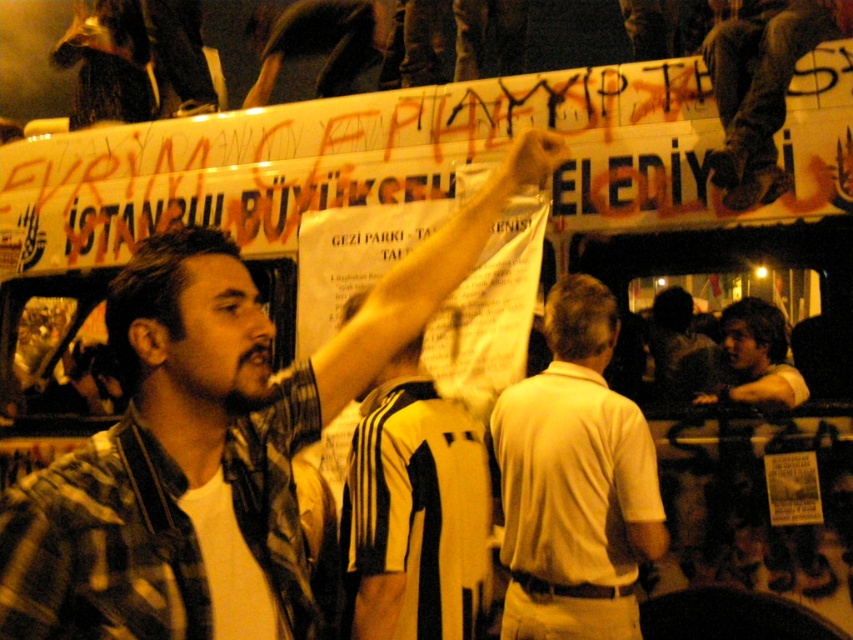
You are a photographer trying to capture the man in the plaid shirt at center and the dark brown leather jacket at upper center in a single shot. Based on their positions, which object is taller in the frame?

The plaid shirt at center is taller than the dark brown leather jacket at upper center, so the plaid shirt at center appears taller in the frame.

Where is the white matte shirt at center located in the image?

The white matte shirt at center is located at point (575, 481) in the image.

You are standing at the front of the crowd and want to hand a leaflet to both the plaid shirt at center and the dark brown leather jacket at upper center. If you can throw a leaflet 3 meters, which person can you reach?

The plaid shirt at center is 3.37 meters away from the dark brown leather jacket at upper center. Since you can throw a leaflet 3 meters, you cannot reach either of them because both are beyond your throwing range.